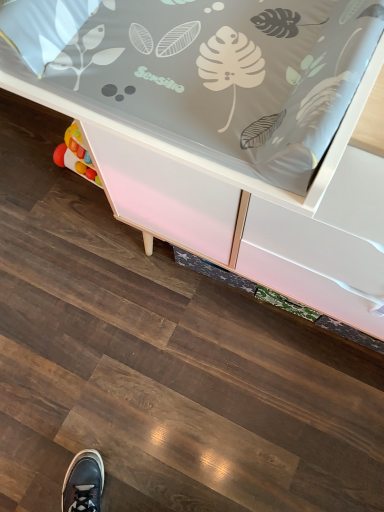
In order to click on vacant space in front of matte pink cabinet at center in this screenshot , I will do `click(253, 403)`.